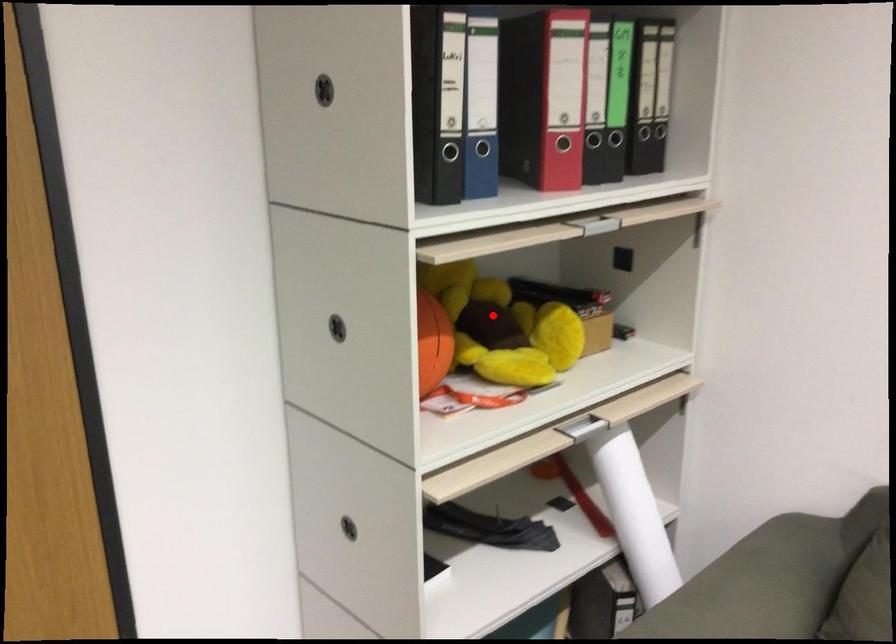
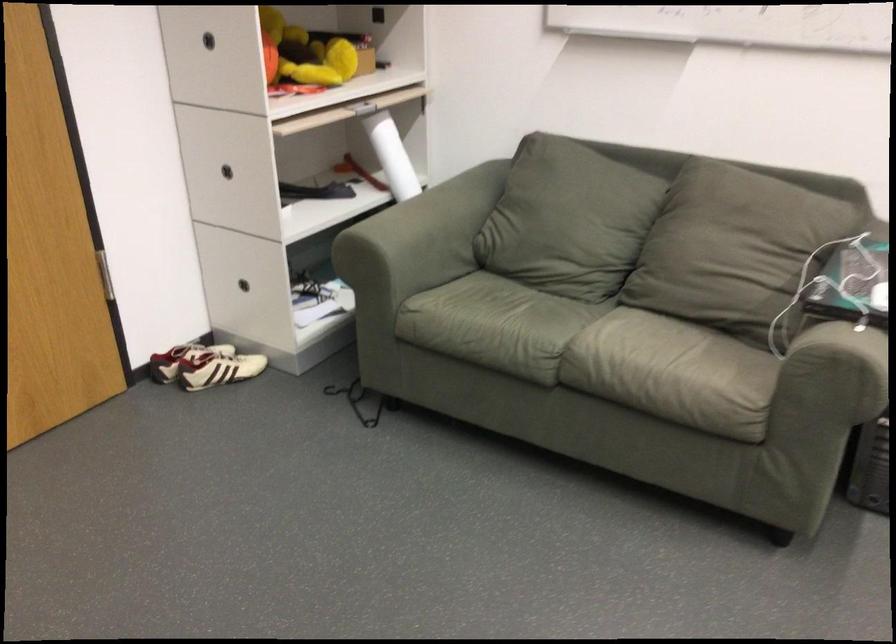
Question: I am providing you with two images of the same scene from different viewpoints. A red point is shown in image1. For the corresponding object point in image2, is it positioned nearer or farther from the camera?

Choices:
 (A) Nearer
 (B) Farther

Answer: (B)